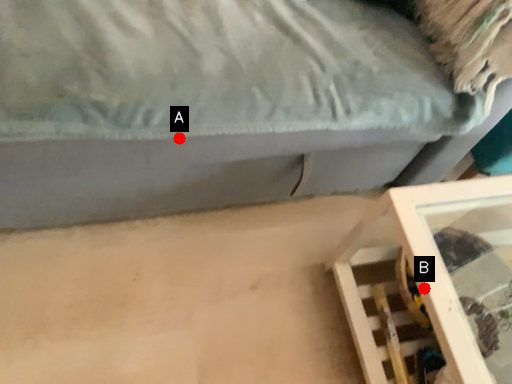
Question: Two points are circled on the image, labeled by A and B beside each circle. Which of the following is the farthest from the observer?

Choices:
 (A) A is further
 (B) B is further

Answer: (A)